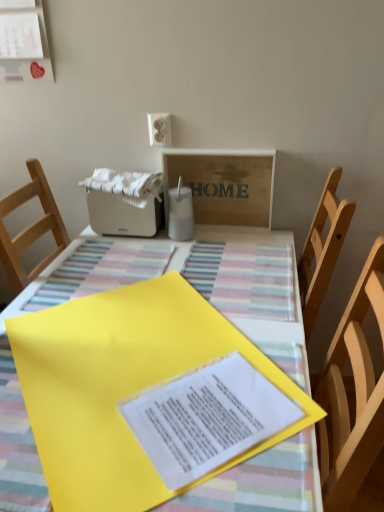
Where is `free spot above yellow paper at center (from a real-world perspective)`? This screenshot has height=512, width=384. free spot above yellow paper at center (from a real-world perspective) is located at coordinates (157, 314).